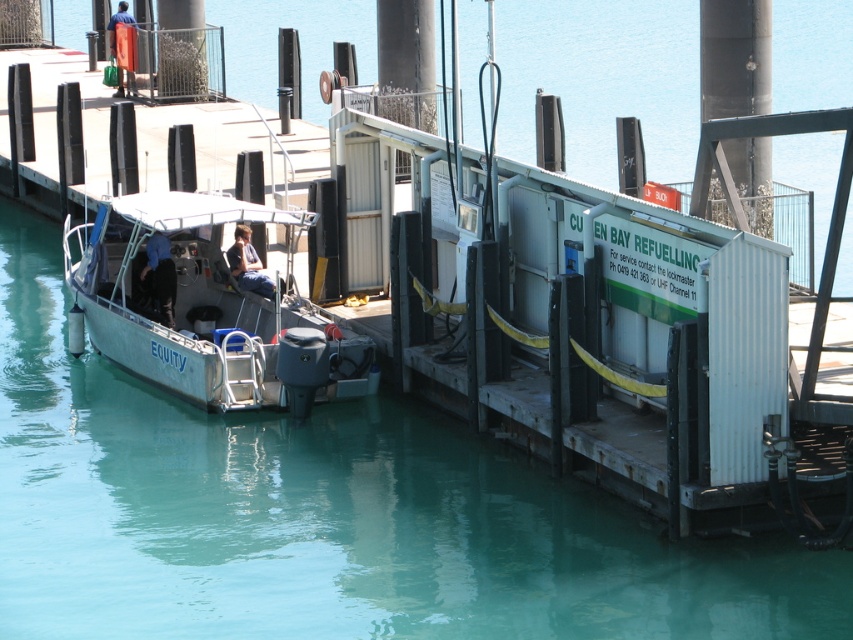
Question: Can you confirm if dark blue jeans at center is positioned to the left of orange fabric bag at upper left?

Choices:
 (A) no
 (B) yes

Answer: (A)

Question: Which of the following is the farthest from the observer?

Choices:
 (A) dark blue fabric jacket at center
 (B) orange fabric bag at upper left
 (C) silver metallic boat at center
 (D) metallic gray boat at center

Answer: (B)

Question: Among these points, which one is nearest to the camera?

Choices:
 (A) (248, 259)
 (B) (152, 237)

Answer: (B)

Question: Does metallic gray boat at center have a lesser width compared to dark blue fabric jacket at center?

Choices:
 (A) yes
 (B) no

Answer: (B)

Question: Which point is farther to the camera?

Choices:
 (A) (164, 262)
 (B) (114, 52)
 (C) (91, 324)

Answer: (B)

Question: Does metallic gray boat at center lie in front of dark blue fabric jacket at center?

Choices:
 (A) no
 (B) yes

Answer: (B)